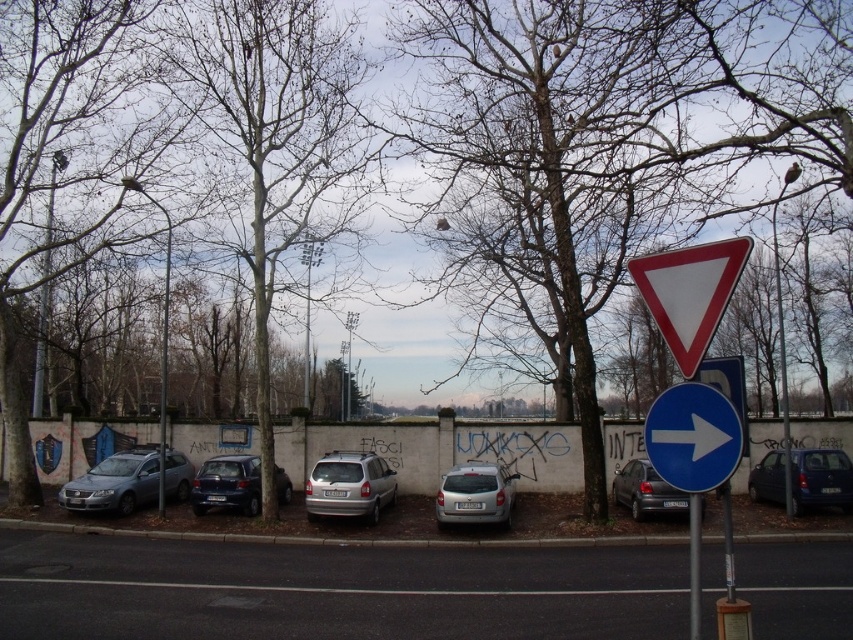
Is silver metallic sedan at left positioned behind silver metallic car at center?

Yes, silver metallic sedan at left is behind silver metallic car at center.

Is silver metallic sedan at left closer to camera compared to silver metallic car at center?

That is False.

Does point (138, 490) come in front of point (461, 467)?

No, it is behind (461, 467).

In order to click on silver metallic sedan at left in this screenshot , I will do `click(128, 481)`.

Which is in front, point (250, 600) or point (283, 488)?

Point (250, 600)

Which is above, gray metallic cars at lower center or blue metallic hatchback at center?

Positioned higher is gray metallic cars at lower center.

At what (x,y) coordinates should I click in order to perform the action: click on gray metallic cars at lower center. Please return your answer as a coordinate pair (x, y). Image resolution: width=853 pixels, height=640 pixels. Looking at the image, I should click on (334, 589).

Is blue glossy arrow at right to the left of silver metallic car at center from the viewer's perspective?

Incorrect, blue glossy arrow at right is not on the left side of silver metallic car at center.

Which of these two, blue glossy arrow at right or silver metallic car at center, stands shorter?

With less height is blue glossy arrow at right.

Is point (705, 465) more distant than point (502, 500)?

That is False.

Locate an element on the screen. blue glossy arrow at right is located at coordinates tap(693, 436).